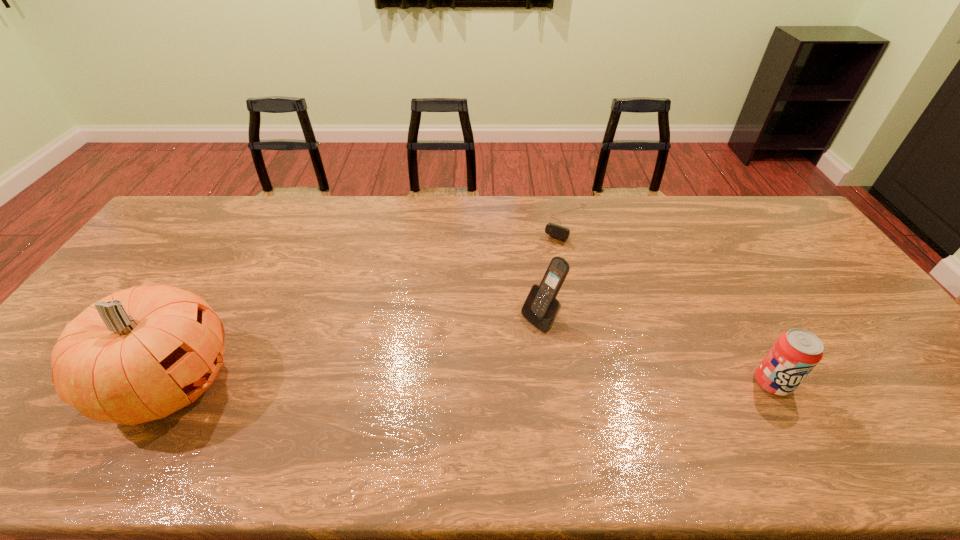
Image resolution: width=960 pixels, height=540 pixels. Find the location of `free space located on the front-facing side of the farthest object`. free space located on the front-facing side of the farthest object is located at coordinates (517, 299).

At what (x,y) coordinates should I click in order to perform the action: click on free space located 0.170m on the front-facing side of the farthest object. Please return your answer as a coordinate pair (x, y). This screenshot has width=960, height=540. Looking at the image, I should click on (536, 272).

The width and height of the screenshot is (960, 540). Find the location of `vacant point located 0.140m on the front-facing side of the cellular telephone`. vacant point located 0.140m on the front-facing side of the cellular telephone is located at coordinates (489, 355).

You are a GUI agent. You are given a task and a screenshot of the screen. Output one action in this format:
    pyautogui.click(x=<x>, y=<y>)
    Task: Click on the free space located 0.050m on the front-facing side of the cellular telephone
    This screenshot has width=960, height=540.
    Given the screenshot: What is the action you would take?
    pyautogui.click(x=514, y=337)

In order to click on free space located 0.260m on the front-facing side of the cellular telephone in this screenshot , I will do `click(452, 381)`.

This screenshot has height=540, width=960. What are the coordinates of `object present at the far edge` in the screenshot? It's located at (557, 231).

I want to click on pumpkin that is at the near edge, so click(x=140, y=354).

Locate an element on the screen. Image resolution: width=960 pixels, height=540 pixels. soda can located in the near edge section of the desktop is located at coordinates (794, 355).

Where is `vacant space at the far edge`? vacant space at the far edge is located at coordinates (329, 200).

This screenshot has width=960, height=540. Find the location of `vacant region at the near edge of the desktop`. vacant region at the near edge of the desktop is located at coordinates (609, 414).